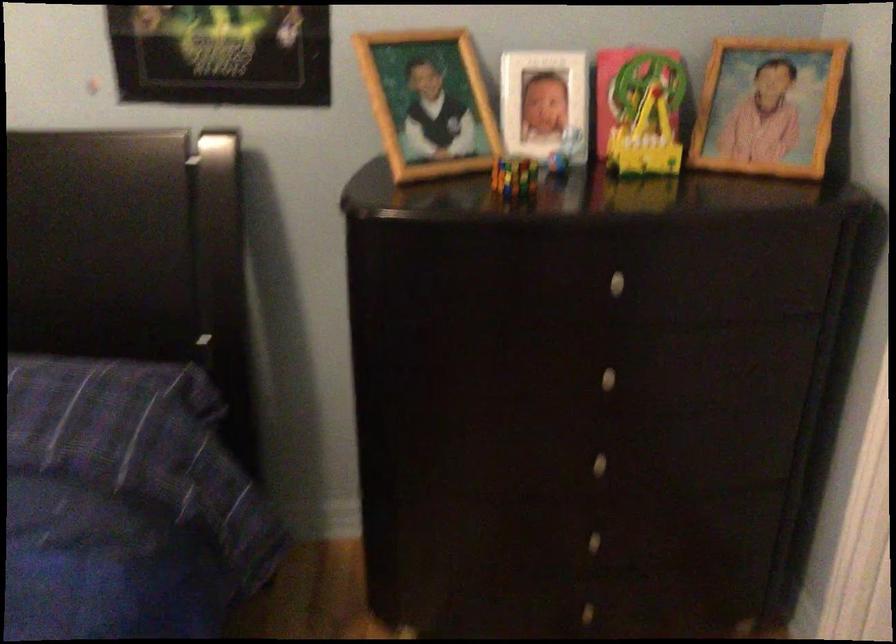
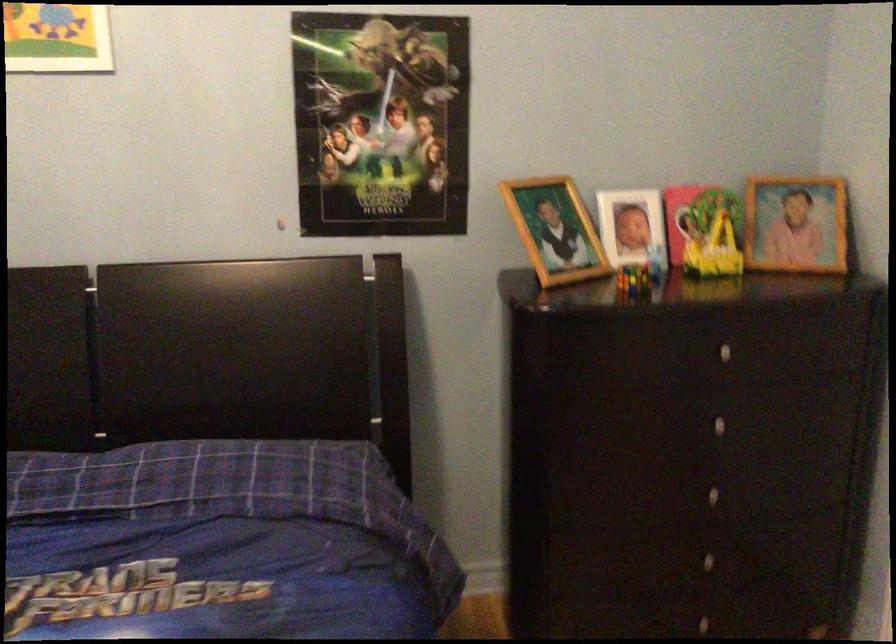
The point at (511, 182) is marked in the first image. Where is the corresponding point in the second image?

(634, 279)